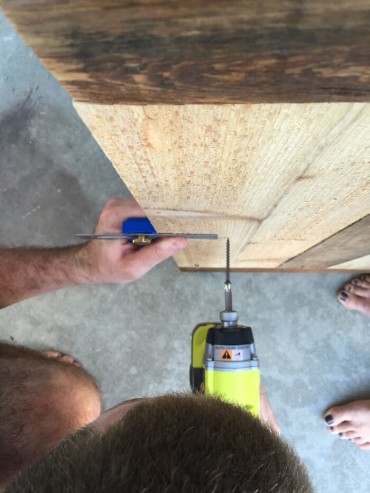
Where is `concrete floor`? This screenshot has width=370, height=493. concrete floor is located at coordinates (313, 344).